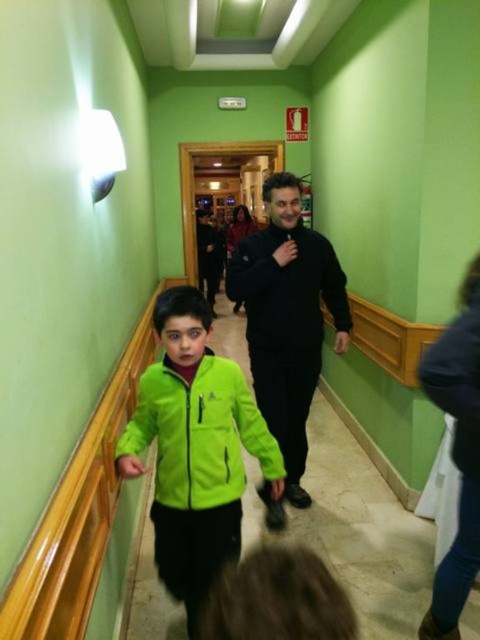
Can you confirm if green fleece jacket at lower left is positioned to the left of black matte sweatshirt at center?

Correct, you'll find green fleece jacket at lower left to the left of black matte sweatshirt at center.

Between green fleece jacket at lower left and black matte sweatshirt at center, which one is positioned lower?

Positioned lower is green fleece jacket at lower left.

Image resolution: width=480 pixels, height=640 pixels. Identify the location of green fleece jacket at lower left. (200, 433).

Between point (269, 259) and point (311, 284), which one is positioned behind?

Positioned behind is point (311, 284).

What are the coordinates of `black matte jacket at center` in the screenshot? It's located at (288, 317).

Between point (271, 372) and point (231, 426), which one is positioned behind?

Positioned behind is point (271, 372).

Which is in front, point (283, 292) or point (162, 480)?

Point (162, 480) is more forward.

Identify the location of black matte jacket at center. (288, 317).